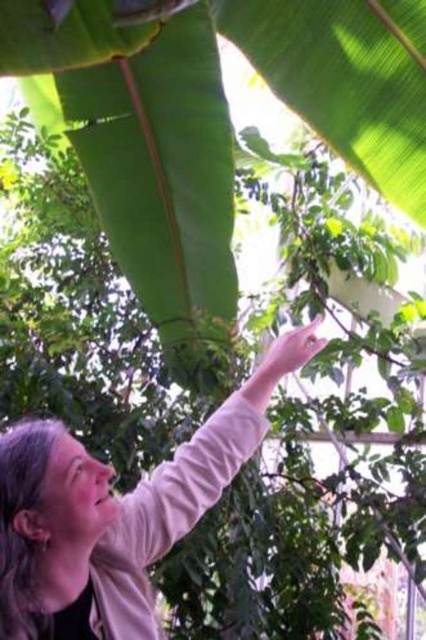
Based on the photo, you are standing in a botanical garden and see the light pink fabric at upper right. If you want to take a photo of it, where should you position yourself relative to the large green leafy plant?

The light pink fabric at upper right is located at coordinates approximately 0.814 on the x axis and 0.246 on the y axis, so you should position yourself to the upper right of the large green leafy plant to capture it in your photo.

You are a photographer trying to capture the light pink fabric at upper right and the pink smooth skin at upper center in the same frame. Based on their positions, which one is higher?

The light pink fabric at upper right has a greater height compared to the pink smooth skin at upper center, so the light pink fabric at upper right is higher.

You are standing in a tropical garden and see two points marked in the image. The first point is at coordinates point (39, 524) and the second is at point (299, 332). Which point is closer to your eyes?

Point (39, 524) is closer to the camera than point (299, 332), so the first point is closer to your eyes.